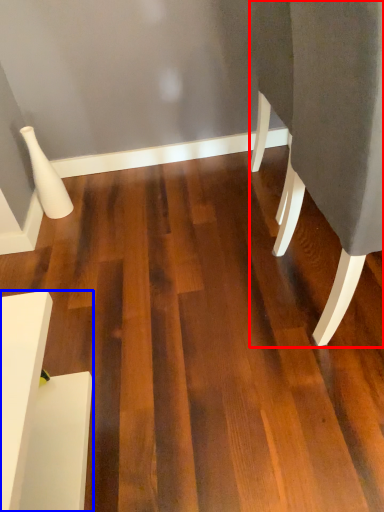
Question: Which of the following is the farthest to the observer, furniture (highlighted by a red box) or furniture (highlighted by a blue box)?

Choices:
 (A) furniture
 (B) furniture

Answer: (B)